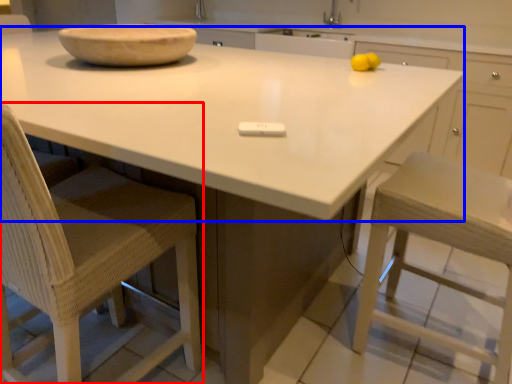
Question: Which object appears farthest to the camera in this image, chair (highlighted by a red box) or countertop (highlighted by a blue box)?

Choices:
 (A) chair
 (B) countertop

Answer: (A)